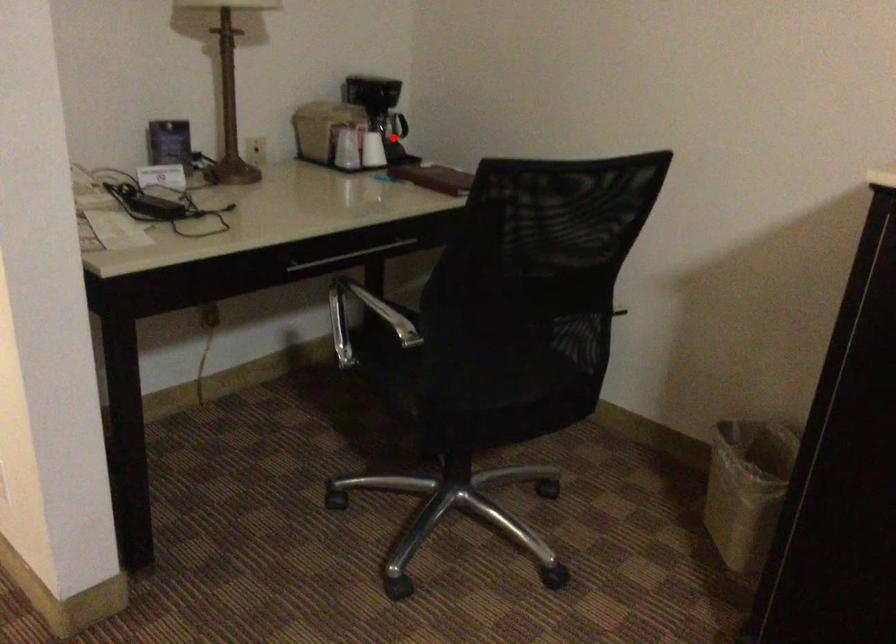
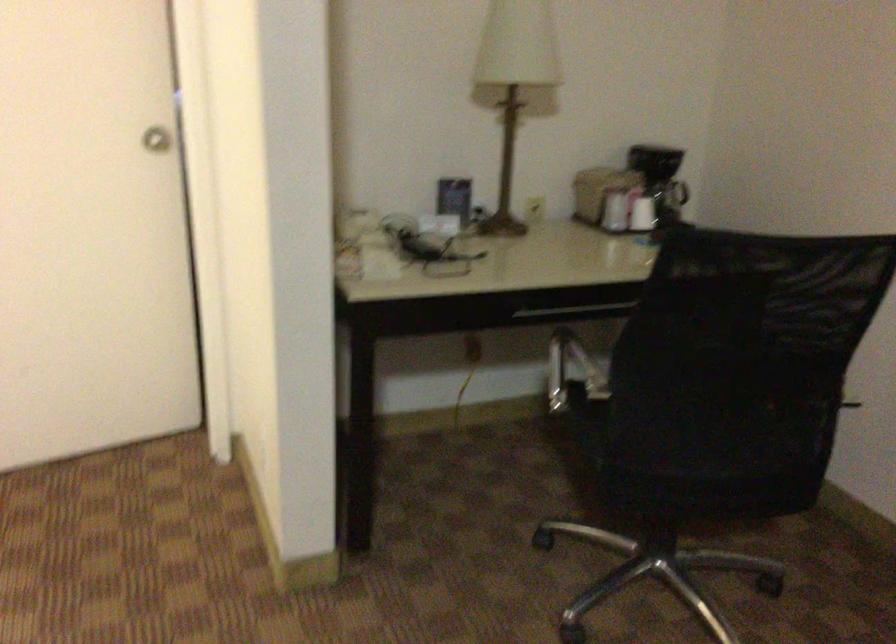
Find the pixel in the second image that matches the highlighted location in the first image.

(677, 202)